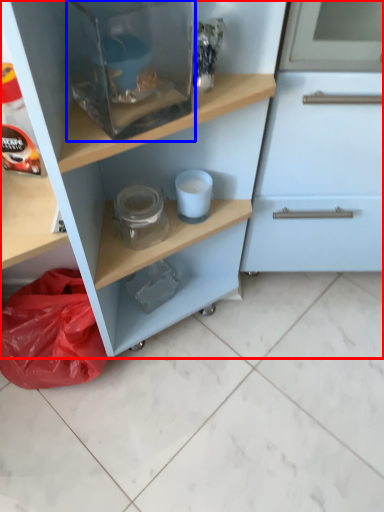
Question: Among these objects, which one is farthest to the camera, cupboard (highlighted by a red box) or appliance (highlighted by a blue box)?

Choices:
 (A) cupboard
 (B) appliance

Answer: (B)